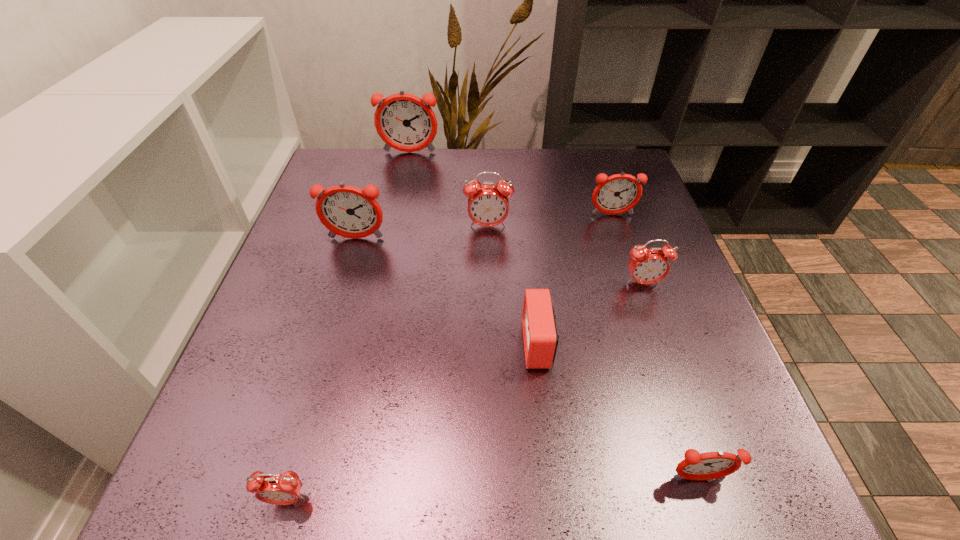
Where is `the biggest reddish-pink alarm clock`? Image resolution: width=960 pixels, height=540 pixels. the biggest reddish-pink alarm clock is located at coordinates (405, 122).

I want to click on the farthest reddish-pink alarm clock, so click(405, 122).

Locate an element on the screen. This screenshot has width=960, height=540. the fifth nearest alarm clock is located at coordinates (347, 211).

I want to click on the fifth nearest object, so click(x=347, y=211).

The height and width of the screenshot is (540, 960). I want to click on the biggest red alarm clock, so click(488, 205).

The image size is (960, 540). What are the coordinates of `the farthest red alarm clock` in the screenshot? It's located at (488, 205).

In order to click on the second farthest reddish-pink alarm clock in this screenshot , I will do `click(619, 193)`.

Where is `the third biggest reddish-pink alarm clock`? the third biggest reddish-pink alarm clock is located at coordinates (619, 193).

At what (x,y) coordinates should I click in order to perform the action: click on the rightmost red alarm clock. Please return your answer as a coordinate pair (x, y). This screenshot has width=960, height=540. Looking at the image, I should click on (647, 266).

Where is `the third smallest red alarm clock`? This screenshot has height=540, width=960. the third smallest red alarm clock is located at coordinates (647, 266).